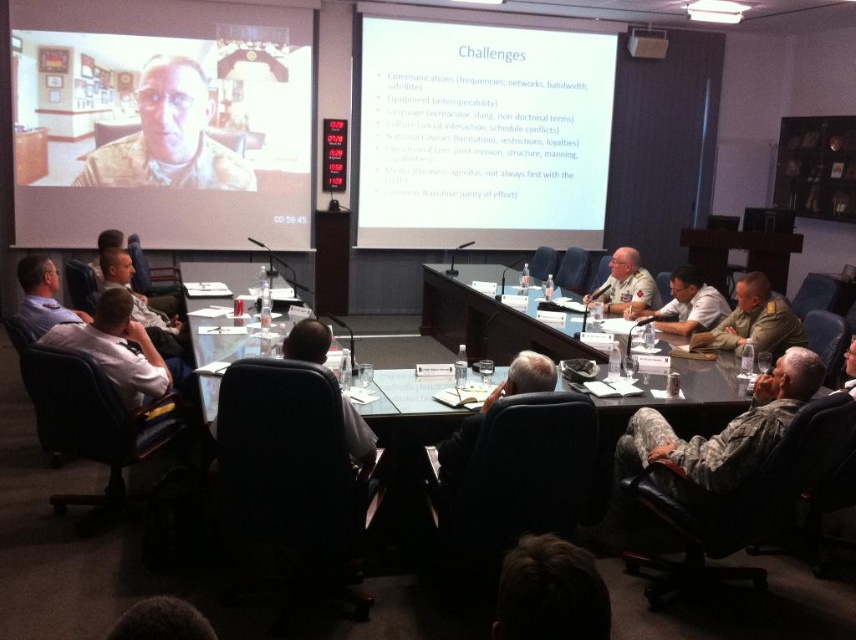
Question: Among these objects, which one is farthest from the camera?

Choices:
 (A) matte black uniform at upper left
 (B) camouflage uniform at lower right
 (C) matte black screen at upper left

Answer: (A)

Question: Can you confirm if wooden polished table at center is positioned above light beige uniform at center?

Choices:
 (A) no
 (B) yes

Answer: (A)

Question: Is wooden polished table at center positioned before light beige uniform at center?

Choices:
 (A) yes
 (B) no

Answer: (A)

Question: Considering the relative positions of camouflage uniform at lower right and camouflage uniform at center in the image provided, where is camouflage uniform at lower right located with respect to camouflage uniform at center?

Choices:
 (A) above
 (B) below

Answer: (B)

Question: Among these objects, which one is nearest to the camera?

Choices:
 (A) matte black uniform at upper left
 (B) white paper at upper center
 (C) matte black screen at upper left

Answer: (C)

Question: Estimate the real-world distances between objects in this image. Which object is closer to the camouflage uniform at center?

Choices:
 (A) camouflage uniform at right
 (B) wooden polished table at center
 (C) white shirt at center

Answer: (A)